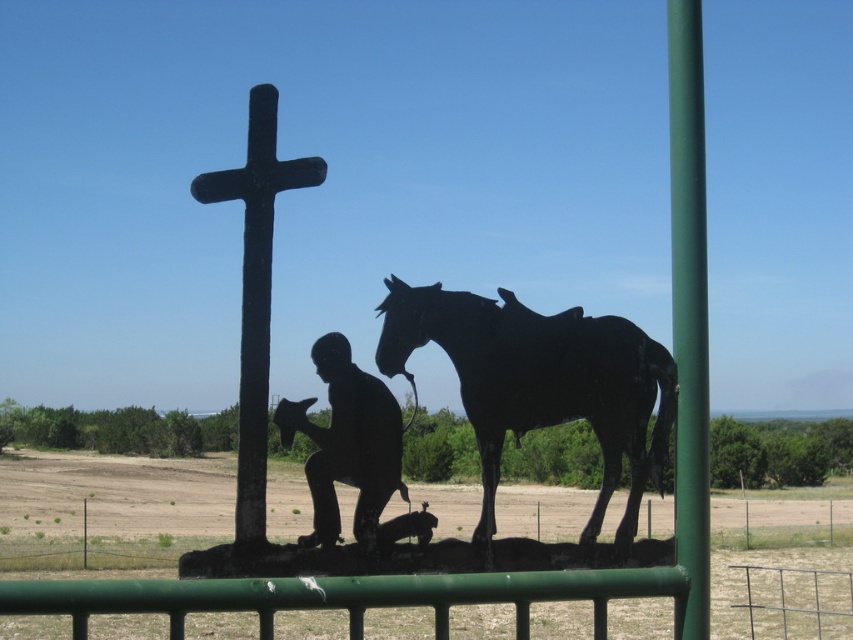
Question: Can you confirm if green metal fence at lower center is positioned below matte black statue at center?

Choices:
 (A) yes
 (B) no

Answer: (A)

Question: Can you confirm if black matte horse at center is thinner than black stone cross at upper center?

Choices:
 (A) no
 (B) yes

Answer: (B)

Question: Which object is positioned farthest from the black matte horse at center?

Choices:
 (A) matte black statue at center
 (B) green metallic pole at right
 (C) green metal fence at lower center
 (D) black stone cross at upper center

Answer: (C)

Question: Which object is the closest to the green metallic pole at right?

Choices:
 (A) matte black statue at center
 (B) green metal fence at lower center
 (C) black matte horse at center

Answer: (C)

Question: Is green metal fence at lower center behind green metallic pole at right?

Choices:
 (A) no
 (B) yes

Answer: (A)

Question: Among these objects, which one is farthest from the camera?

Choices:
 (A) matte black statue at center
 (B) black stone cross at upper center

Answer: (B)